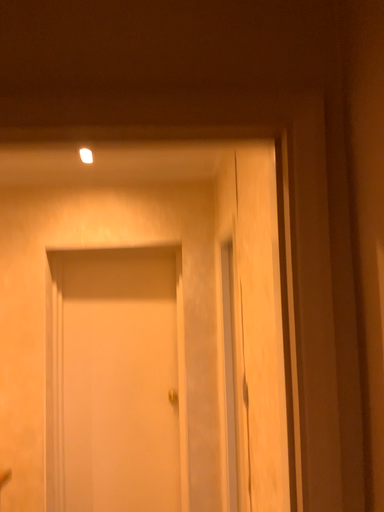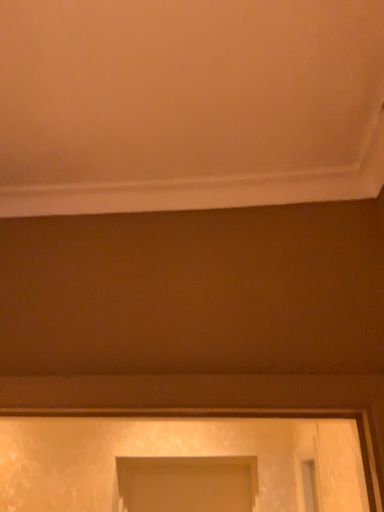
Question: Which way did the camera rotate in the video?

Choices:
 (A) rotated right
 (B) rotated left

Answer: (B)